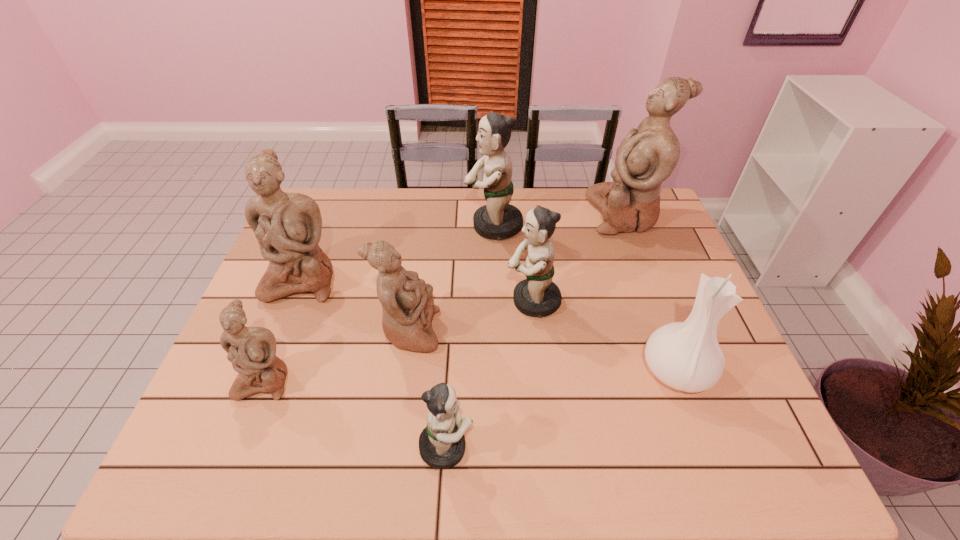
Where is `the smallest green figurine`? the smallest green figurine is located at coordinates (442, 443).

Where is `the nearest figurine`? This screenshot has height=540, width=960. the nearest figurine is located at coordinates (442, 443).

You are a GUI agent. You are given a task and a screenshot of the screen. Output one action in this format:
    pyautogui.click(x=<x>, y=<y>)
    Task: Click on the vacant space located on the front-facing side of the rightmost figurine
    
    Given the screenshot: What is the action you would take?
    pyautogui.click(x=547, y=215)

You are a GUI agent. You are given a task and a screenshot of the screen. Output one action in this format:
    pyautogui.click(x=<x>, y=<y>)
    Task: Click on the vacant area situated 0.340m on the front-facing side of the rightmost figurine
    
    Given the screenshot: What is the action you would take?
    pyautogui.click(x=488, y=215)

Image resolution: width=960 pixels, height=540 pixels. I want to click on free location located 0.190m on the front-facing side of the rightmost figurine, so click(532, 215).

This screenshot has height=540, width=960. I want to click on free space located 0.190m on the front-facing side of the farthest green figurine, so click(407, 226).

Find the location of a particular element. Image resolution: width=960 pixels, height=540 pixels. free space located on the front-facing side of the farthest green figurine is located at coordinates tap(422, 226).

The height and width of the screenshot is (540, 960). What are the coordinates of `vacant space located 0.130m on the front-facing side of the farthest green figurine` in the screenshot? It's located at (425, 226).

Image resolution: width=960 pixels, height=540 pixels. Find the location of `vacant area situated 0.280m on the front-facing side of the second biggest white figurine`. vacant area situated 0.280m on the front-facing side of the second biggest white figurine is located at coordinates (254, 399).

Identify the location of vacant space located 0.340m on the front-facing side of the second farthest green figurine. This screenshot has height=540, width=960. (381, 301).